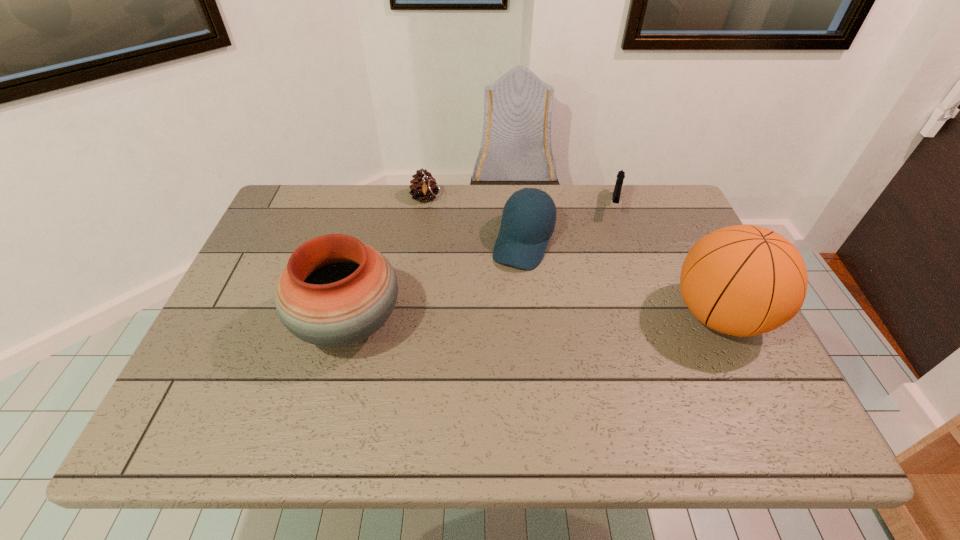
You are a GUI agent. You are given a task and a screenshot of the screen. Output one action in this format:
    pyautogui.click(x=<x>, y=<y>)
    Task: Click on the empty space that is in between the pottery and the fourth object from left to right
    
    Given the screenshot: What is the action you would take?
    pos(481,265)

I want to click on free space between the baseball cap and the fourth object from left to right, so click(569, 224).

Locate an element on the screen. The width and height of the screenshot is (960, 540). vacant area that lies between the pistol and the pottery is located at coordinates (481, 265).

Identify the location of free space between the second object from right to left and the pottery. (481, 265).

Locate an element on the screen. free space between the second object from right to left and the third shortest object is located at coordinates (569, 224).

Identify the location of vacant area that lies between the third tallest object and the pinecone. (475, 220).

Where is `object that is the fourth nearest to the baseball cap`? object that is the fourth nearest to the baseball cap is located at coordinates (743, 280).

This screenshot has width=960, height=540. Identify the location of object that is the fourth closest to the pinecone. (743, 280).

The height and width of the screenshot is (540, 960). Identify the location of free space that satisfies the following two spatial constraints: 1. on the back side of the pinecone; 2. on the right side of the pottery. (382, 198).

I want to click on blank space that satisfies the following two spatial constraints: 1. on the front side of the pistol; 2. on the right side of the pinecone, so click(424, 206).